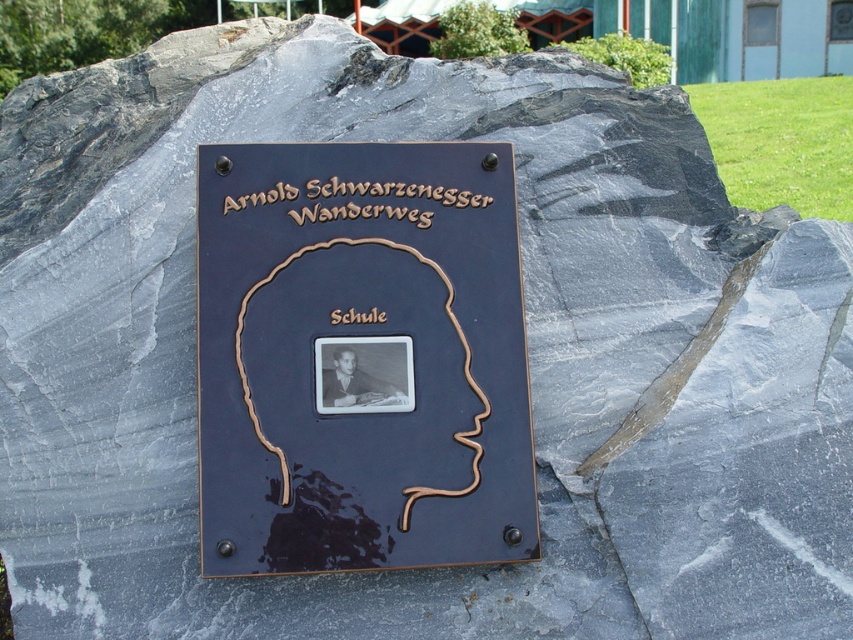
Question: Among these objects, which one is nearest to the camera?

Choices:
 (A) black matte plaque at center
 (B) brown wood sign at center

Answer: (A)

Question: Can you confirm if black matte plaque at center is wider than bronze plaque at upper center?

Choices:
 (A) yes
 (B) no

Answer: (B)

Question: Is black matte plaque at center wider than bronze plaque at upper center?

Choices:
 (A) no
 (B) yes

Answer: (A)

Question: Which of the following is the farthest from the observer?

Choices:
 (A) brown wood sign at center
 (B) bronze plaque at center

Answer: (A)

Question: Is bronze plaque at upper center further to the viewer compared to brown wood sign at center?

Choices:
 (A) yes
 (B) no

Answer: (A)

Question: Which object is the closest to the bronze plaque at upper center?

Choices:
 (A) brown wood sign at center
 (B) bronze plaque at center

Answer: (B)